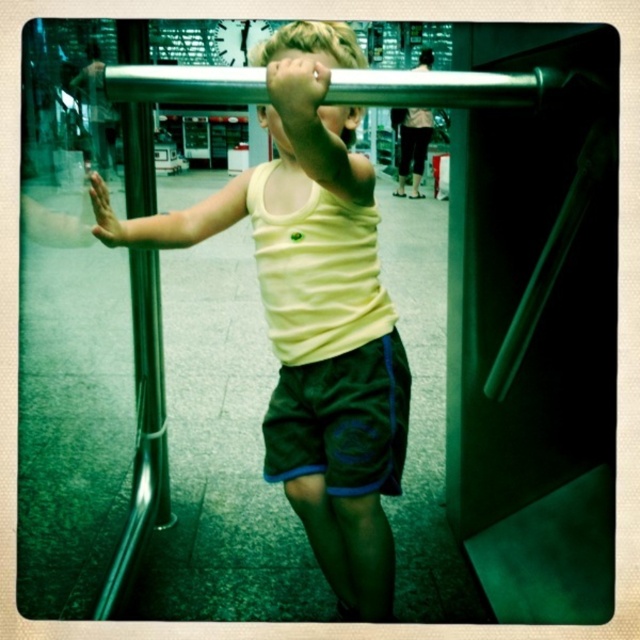
Question: Can you confirm if silver metallic rail at upper center is positioned to the left of satin silver pole at left?

Choices:
 (A) no
 (B) yes

Answer: (A)

Question: Does dark blue cotton shorts at center lie behind satin silver pole at left?

Choices:
 (A) yes
 (B) no

Answer: (A)

Question: Among these points, which one is nearest to the camera?

Choices:
 (A) (182, 230)
 (B) (483, 76)
 (C) (381, 422)

Answer: (B)

Question: Which of these objects is positioned farthest from the silver metallic rail at upper center?

Choices:
 (A) satin silver pole at left
 (B) dark blue cotton shorts at center

Answer: (A)

Question: Is silver metallic rail at upper center closer to camera compared to satin silver pole at left?

Choices:
 (A) yes
 (B) no

Answer: (A)

Question: Which object is the closest to the yellow matte tank top at center?

Choices:
 (A) silver metallic rail at upper center
 (B) dark gray pants at upper center

Answer: (A)